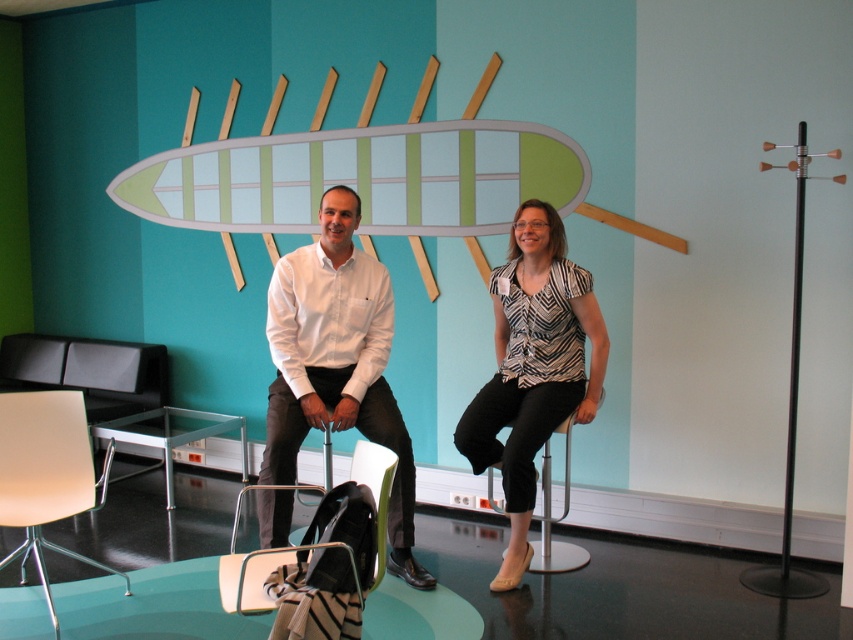
Question: Estimate the real-world distances between objects in this image. Which object is closer to the white glossy shirt at center?

Choices:
 (A) metallic silver stool at center
 (B) patterned fabric blouse at center
 (C) clear plastic chair at center
 (D) matte white chair at lower left

Answer: (C)

Question: Which point is farther to the camera?

Choices:
 (A) (549, 440)
 (B) (230, 586)
 (C) (585, 292)

Answer: (A)

Question: Which point appears farthest from the camera in this image?

Choices:
 (A) (492, 445)
 (B) (387, 326)

Answer: (B)

Question: Is patterned fabric blouse at center positioned behind metallic silver stool at center?

Choices:
 (A) yes
 (B) no

Answer: (B)

Question: Is matte white chair at lower left further to camera compared to clear plastic chair at center?

Choices:
 (A) no
 (B) yes

Answer: (B)

Question: Can you confirm if matte white chair at lower left is positioned to the left of clear plastic chair at center?

Choices:
 (A) yes
 (B) no

Answer: (A)